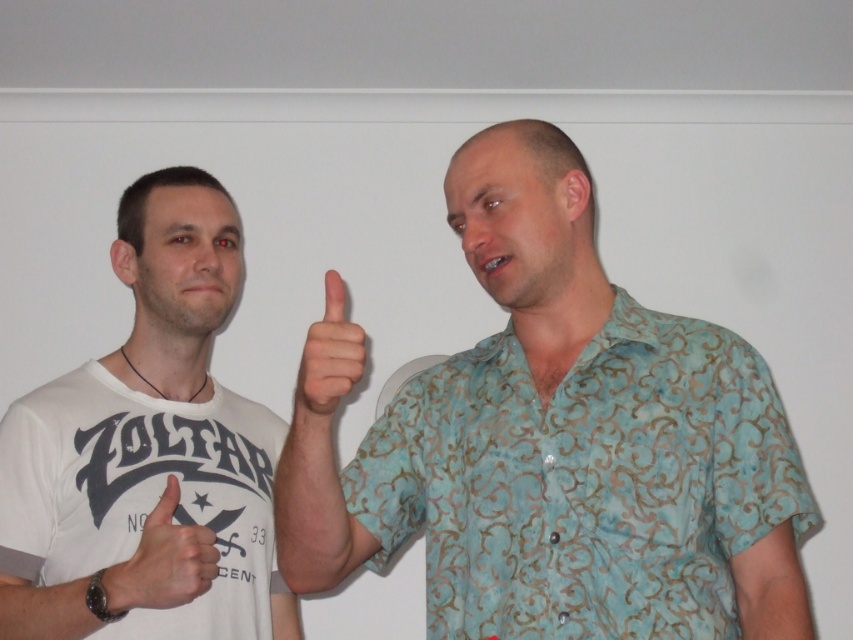
You are standing at the point labeled point (178, 493) in the image. You want to take a photo of the two people in the scene using a camera that has a maximum focus range of 1.5 meters. Will the camera be able to focus on the two people?

The point labeled point (178, 493) and the camera are 1.53 meters apart. Since the maximum focus range of the camera is 1.5 meters, the camera will not be able to focus on the two people because the distance exceeds the maximum focus range.

You are standing in a room with two people. You need to place a small sticker exactly at the point with coordinates point (560, 444). Which person should you give the sticker to?

The point (560, 444) is on blue patterned shirt at center, so you should give the sticker to the person wearing the blue patterned shirt at center.